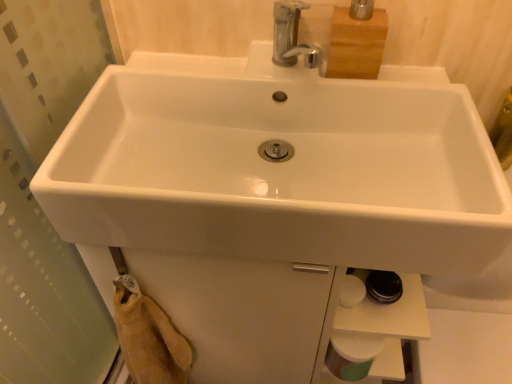
Question: In the image, is white matte toilet paper at lower right on the left side or the right side of white glossy sink at center?

Choices:
 (A) right
 (B) left

Answer: (A)

Question: In terms of size, does white matte toilet paper at lower right appear bigger or smaller than white glossy sink at center?

Choices:
 (A) small
 (B) big

Answer: (A)

Question: Considering their positions, is white matte toilet paper at lower right located in front of or behind white glossy sink at center?

Choices:
 (A) behind
 (B) front

Answer: (A)

Question: Is point (126, 97) positioned closer to the camera than point (339, 357)?

Choices:
 (A) closer
 (B) farther

Answer: (A)

Question: Considering the positions of white glossy sink at center and white matte toilet paper at lower right in the image, is white glossy sink at center bigger or smaller than white matte toilet paper at lower right?

Choices:
 (A) small
 (B) big

Answer: (B)

Question: Considering the positions of white glossy sink at center and white matte toilet paper at lower right in the image, is white glossy sink at center taller or shorter than white matte toilet paper at lower right?

Choices:
 (A) tall
 (B) short

Answer: (A)

Question: Considering their positions, is white glossy sink at center located in front of or behind white matte toilet paper at lower right?

Choices:
 (A) front
 (B) behind

Answer: (A)